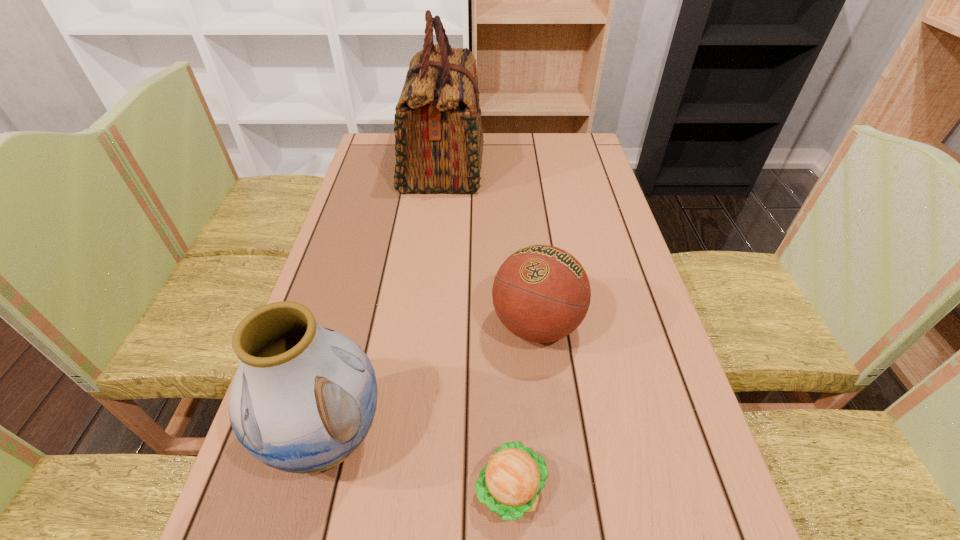
Identify the location of object at the far edge. The width and height of the screenshot is (960, 540). (438, 129).

I want to click on shopping bag present at the left edge, so click(438, 129).

You are a GUI agent. You are given a task and a screenshot of the screen. Output one action in this format:
    pyautogui.click(x=<x>, y=<y>)
    Task: Click on the vase positioned at the left edge
    
    Given the screenshot: What is the action you would take?
    pyautogui.click(x=303, y=399)

Find the location of a particular element. Image resolution: width=960 pixels, height=540 pixels. object that is at the far left corner is located at coordinates (438, 129).

Identify the location of vacant region at the far edge of the desktop. The width and height of the screenshot is (960, 540). (492, 145).

Identify the location of free space at the left edge of the desktop. Image resolution: width=960 pixels, height=540 pixels. [x=373, y=293].

Image resolution: width=960 pixels, height=540 pixels. I want to click on vacant space at the right edge, so click(558, 192).

The width and height of the screenshot is (960, 540). Identify the location of vacant space at the far right corner. (593, 166).

Locate an element on the screen. The image size is (960, 540). free space between the hamburger and the tallest object is located at coordinates (477, 327).

At what (x,y) coordinates should I click in order to perform the action: click on vacant space that's between the third shortest object and the shortest object. Please return your answer as a coordinate pair (x, y). The height and width of the screenshot is (540, 960). Looking at the image, I should click on (420, 462).